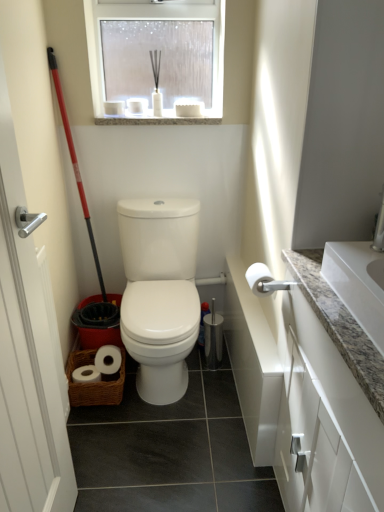
Question: Is the depth of white glossy toilet at center greater than that of red plastic shovel at left?

Choices:
 (A) yes
 (B) no

Answer: (A)

Question: Considering the relative sizes of white glossy toilet at center and red plastic shovel at left in the image provided, is white glossy toilet at center thinner than red plastic shovel at left?

Choices:
 (A) no
 (B) yes

Answer: (A)

Question: From a real-world perspective, is white glossy toilet at center positioned over red plastic shovel at left based on gravity?

Choices:
 (A) yes
 (B) no

Answer: (B)

Question: Is red plastic shovel at left at the back of white glossy toilet at center?

Choices:
 (A) yes
 (B) no

Answer: (B)

Question: Is white glossy toilet at center shorter than red plastic shovel at left?

Choices:
 (A) yes
 (B) no

Answer: (A)

Question: Looking at their shapes, would you say white glossy toilet at center is wider or thinner than granite at upper center?

Choices:
 (A) thin
 (B) wide

Answer: (B)

Question: Is white glossy toilet at center inside the boundaries of granite at upper center, or outside?

Choices:
 (A) inside
 (B) outside

Answer: (B)

Question: From the image's perspective, is white glossy toilet at center above or below granite at upper center?

Choices:
 (A) below
 (B) above

Answer: (A)

Question: Would you say white glossy toilet at center is to the left or to the right of granite at upper center in the picture?

Choices:
 (A) left
 (B) right

Answer: (B)

Question: Considering the positions of granite at upper center and white granite sink at upper right in the image, is granite at upper center wider or thinner than white granite sink at upper right?

Choices:
 (A) wide
 (B) thin

Answer: (A)

Question: In the image, is granite at upper center positioned in front of or behind white granite sink at upper right?

Choices:
 (A) front
 (B) behind

Answer: (B)

Question: From the image's perspective, is granite at upper center located above or below white granite sink at upper right?

Choices:
 (A) above
 (B) below

Answer: (A)

Question: Considering the positions of point (167, 121) and point (329, 252), is point (167, 121) closer or farther from the camera than point (329, 252)?

Choices:
 (A) farther
 (B) closer

Answer: (A)

Question: Is white matte toilet paper at right spatially inside silver metallic screen door at left, or outside of it?

Choices:
 (A) outside
 (B) inside

Answer: (A)

Question: Is white matte toilet paper at right taller or shorter than silver metallic screen door at left?

Choices:
 (A) tall
 (B) short

Answer: (B)